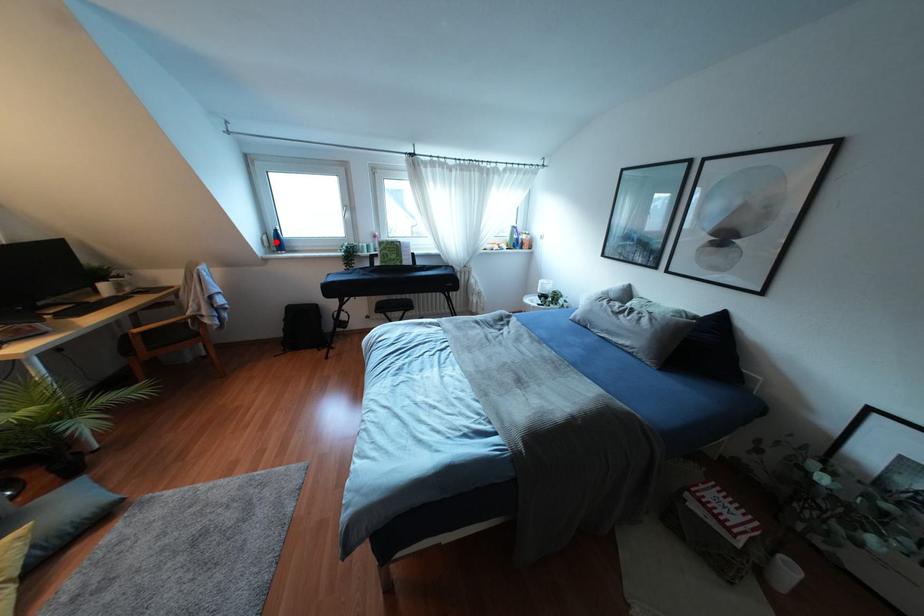
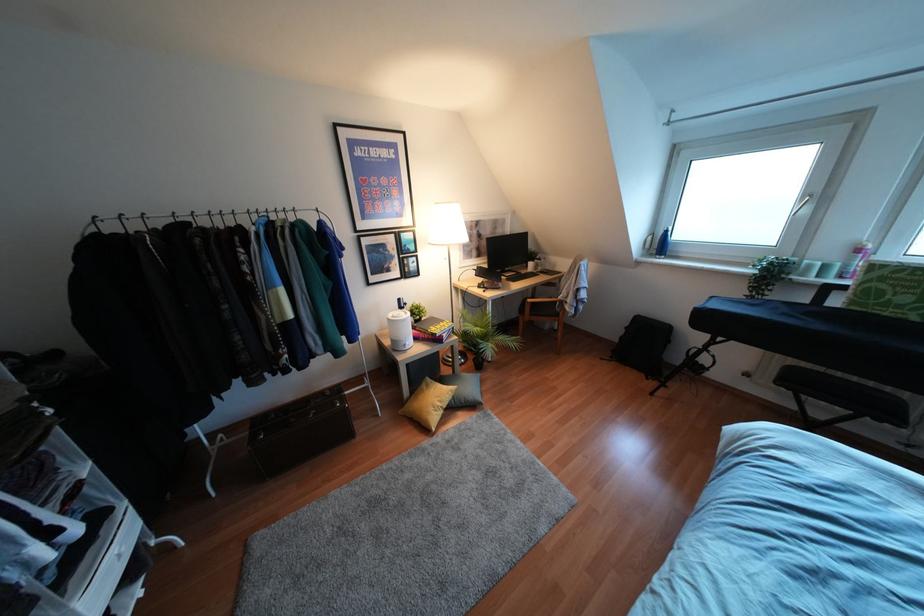
Question: I am providing you with two images of the same scene from different viewpoints. Given a red point in image1, look at the same physical point in image2. Is it:

Choices:
 (A) Closer to the viewpoint
 (B) Farther from the viewpoint

Answer: (A)